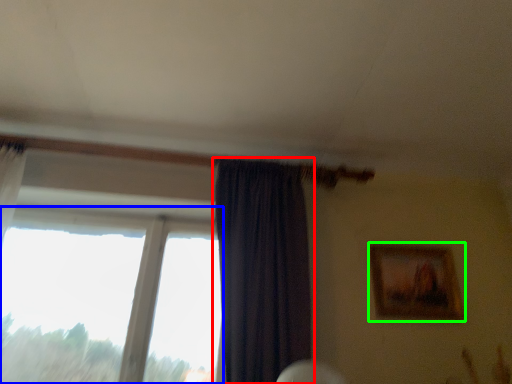
Question: Which is nearer to the curtain (highlighted by a red box)? window (highlighted by a blue box) or picture frame (highlighted by a green box).

Choices:
 (A) window
 (B) picture frame

Answer: (A)